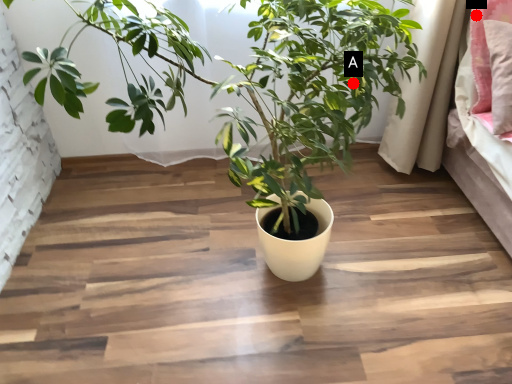
Question: Two points are circled on the image, labeled by A and B beside each circle. Which point is farther from the camera taking this photo?

Choices:
 (A) A is further
 (B) B is further

Answer: (B)